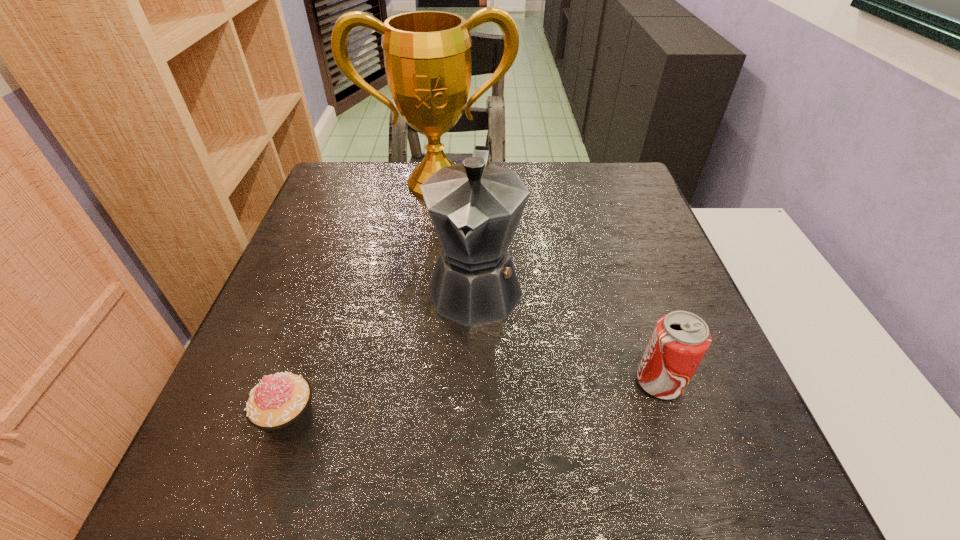
Identify the location of vacant space located on the front-facing side of the farthest object. (457, 300).

What are the coordinates of `vacant space situated 0.080m on the front-facing side of the farthest object` in the screenshot? It's located at (447, 221).

You are a GUI agent. You are given a task and a screenshot of the screen. Output one action in this format:
    pyautogui.click(x=<x>, y=<y>)
    Task: Click on the blank space located at the spout of the second tallest object
    The image size is (960, 540).
    Given the screenshot: What is the action you would take?
    pyautogui.click(x=465, y=366)

This screenshot has width=960, height=540. In order to click on free region located 0.170m at the spout of the second tallest object in this screenshot , I will do `click(457, 415)`.

Identify the location of vacant point located at the spout of the second tallest object. (460, 395).

This screenshot has height=540, width=960. What are the coordinates of `object present at the far edge` in the screenshot? It's located at [427, 56].

At what (x,y) coordinates should I click in order to perform the action: click on cupcake positioned at the near edge. Please return your answer as a coordinate pair (x, y). This screenshot has width=960, height=540. Looking at the image, I should click on (280, 405).

What are the coordinates of `soda can at the near edge` in the screenshot? It's located at (680, 339).

Where is `cupcake present at the left edge`? The width and height of the screenshot is (960, 540). cupcake present at the left edge is located at coordinates (280, 405).

Identify the location of award that is at the left edge. (427, 56).